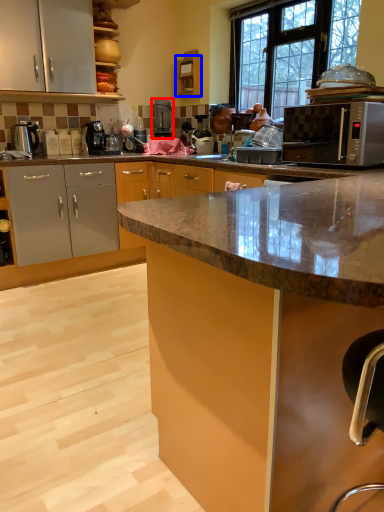
Question: Which point is closer to the camera, coffee machine (highlighted by a red box) or cabinetry (highlighted by a blue box)?

Choices:
 (A) coffee machine
 (B) cabinetry

Answer: (B)